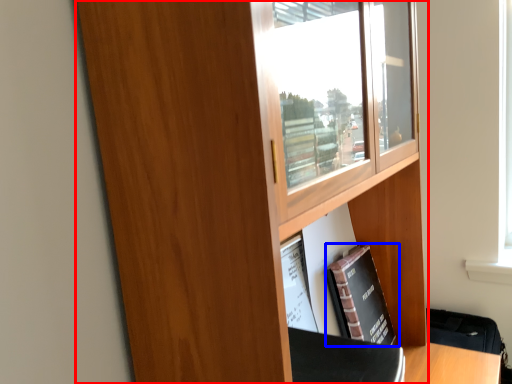
Question: Among these objects, which one is farthest to the camera, cupboard (highlighted by a red box) or book (highlighted by a blue box)?

Choices:
 (A) cupboard
 (B) book

Answer: (B)